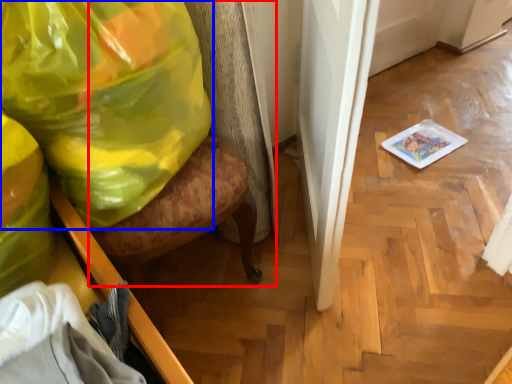
Question: Among these objects, which one is farthest to the camera, swivel chair (highlighted by a red box) or plastic bag (highlighted by a blue box)?

Choices:
 (A) swivel chair
 (B) plastic bag

Answer: (B)